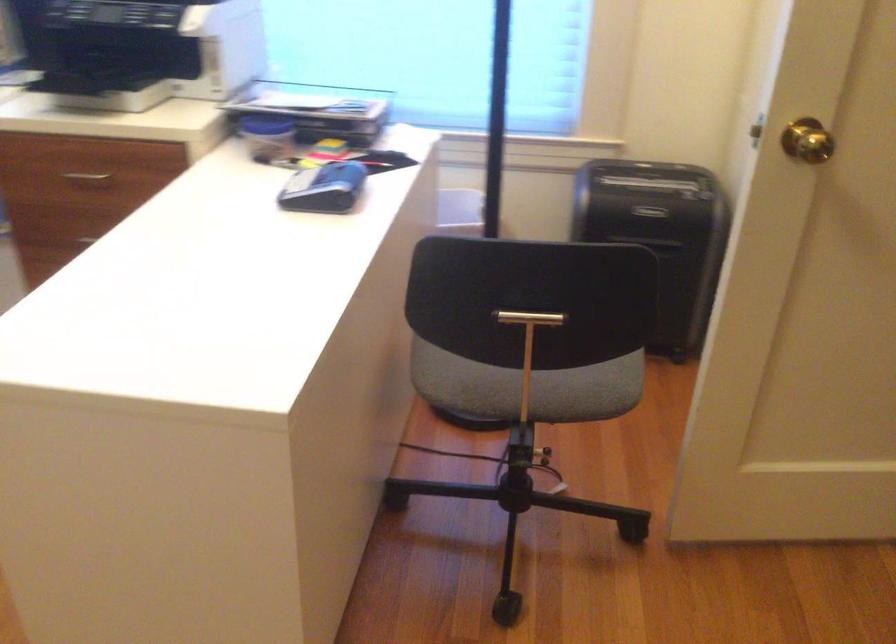
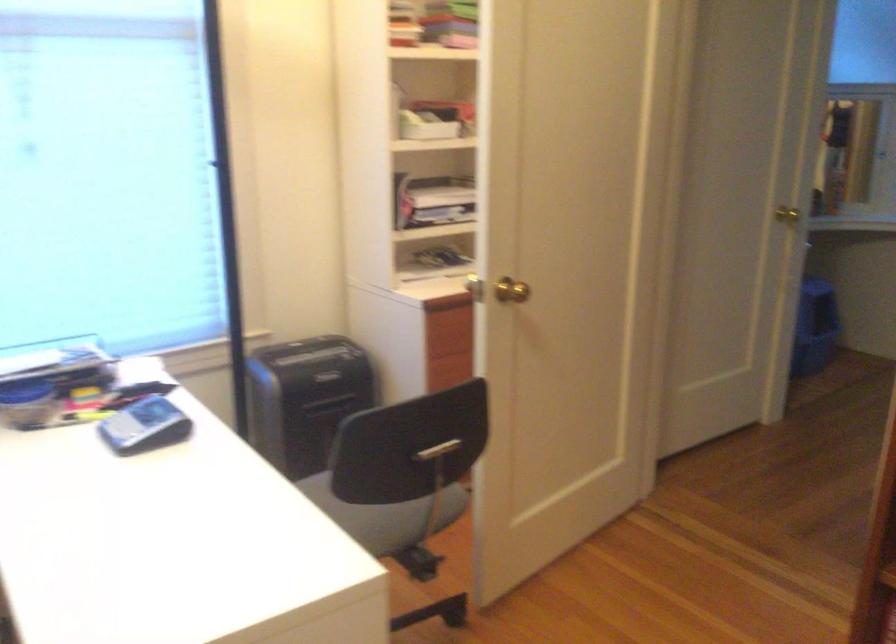
The point at (x=315, y=185) is marked in the first image. Where is the corresponding point in the second image?

(143, 426)